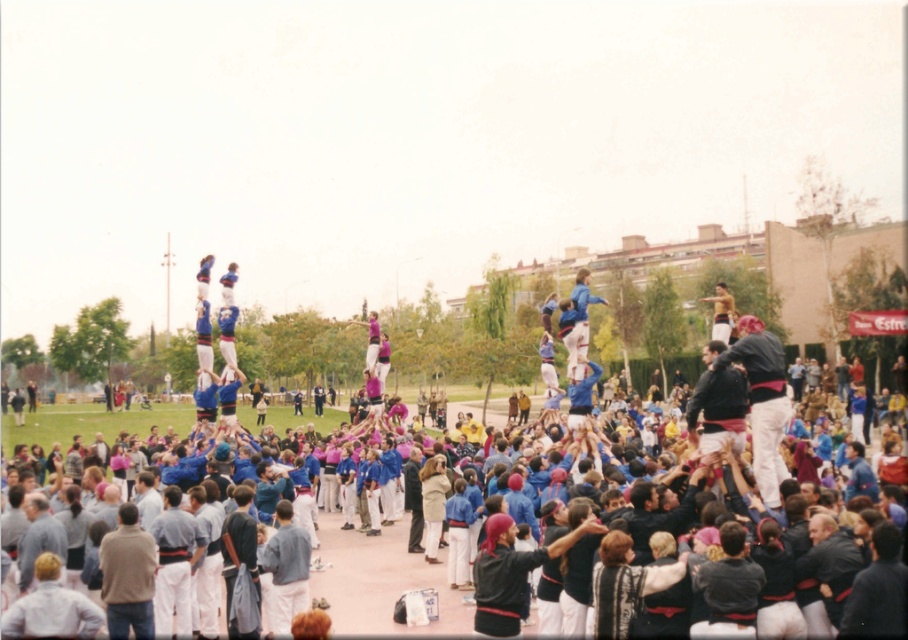
Is dark blue fabric at center in front of light beige coat at center?

Yes, dark blue fabric at center is in front of light beige coat at center.

Can you confirm if dark blue fabric at center is positioned to the right of light beige coat at center?

Indeed, dark blue fabric at center is positioned on the right side of light beige coat at center.

I want to click on dark blue fabric at center, so click(x=762, y=401).

Where is `dark blue fabric at center`? dark blue fabric at center is located at coordinates (762, 401).

Does blue fabric crowd at center have a greater width compared to light beige coat at center?

Indeed, blue fabric crowd at center has a greater width compared to light beige coat at center.

Looking at this image, can you confirm if blue fabric crowd at center is positioned to the right of light beige coat at center?

Yes, blue fabric crowd at center is to the right of light beige coat at center.

Looking at this image, who is more distant from viewer, (352,525) or (437,532)?

The point (352,525) is more distant.

The height and width of the screenshot is (640, 908). Identify the location of blue fabric crowd at center. (357, 461).

Is blue fabric crowd at center wider than dark blue fabric at center?

Correct, the width of blue fabric crowd at center exceeds that of dark blue fabric at center.

Can you confirm if blue fabric crowd at center is shorter than dark blue fabric at center?

No.

Is point (344, 483) behind point (775, 346)?

Yes, it is behind point (775, 346).

You are a GUI agent. You are given a task and a screenshot of the screen. Output one action in this format:
    pyautogui.click(x=<x>, y=<y>)
    Task: Click on the blue fabric crowd at center
    
    Given the screenshot: What is the action you would take?
    pyautogui.click(x=357, y=461)